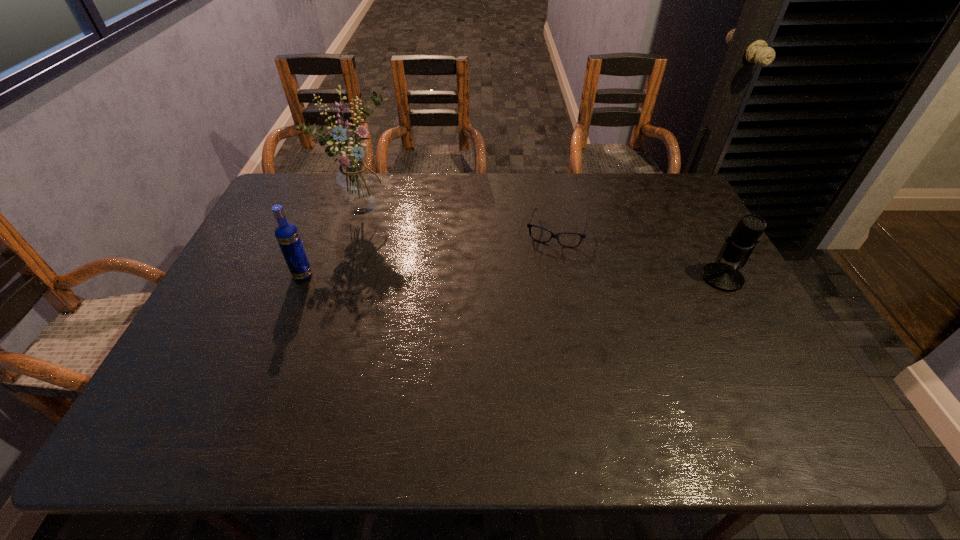
Identify the location of free space at the near right corner of the desktop. The width and height of the screenshot is (960, 540). (760, 379).

I want to click on unoccupied position between the bouquet and the shortest object, so click(460, 220).

At what (x,y) coordinates should I click in order to perform the action: click on free space that is in between the bouquet and the spectacles. Please return your answer as a coordinate pair (x, y). Looking at the image, I should click on (460, 220).

You are a GUI agent. You are given a task and a screenshot of the screen. Output one action in this format:
    pyautogui.click(x=<x>, y=<y>)
    Task: Click on the blank region between the microphone and the spectacles
    This screenshot has height=540, width=960.
    Given the screenshot: What is the action you would take?
    pyautogui.click(x=639, y=254)

This screenshot has width=960, height=540. I want to click on vacant space in between the tallest object and the microphone, so click(542, 243).

The width and height of the screenshot is (960, 540). In order to click on free space between the microphone and the tallest object in this screenshot , I will do `click(542, 243)`.

Where is `vacant point located between the vodka and the microphone`? The height and width of the screenshot is (540, 960). vacant point located between the vodka and the microphone is located at coordinates (513, 276).

This screenshot has height=540, width=960. I want to click on empty space between the spectacles and the vodka, so click(x=430, y=253).

The image size is (960, 540). What are the coordinates of `free spot between the tallest object and the spectacles` in the screenshot? It's located at (460, 220).

This screenshot has height=540, width=960. Identify the location of vacant space that's between the bouquet and the microphone. (542, 243).